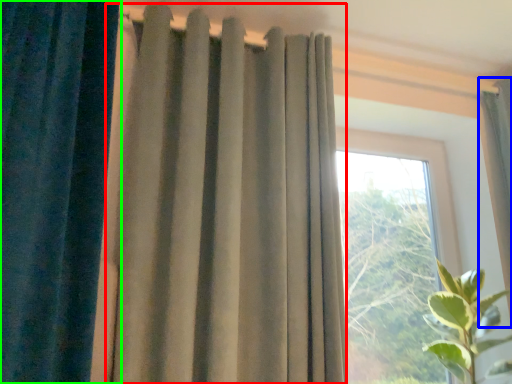
Question: Estimate the real-world distances between objects in this image. Which object is farther from curtain (highlighted by a red box), curtain (highlighted by a blue box) or curtain (highlighted by a green box)?

Choices:
 (A) curtain
 (B) curtain

Answer: (A)